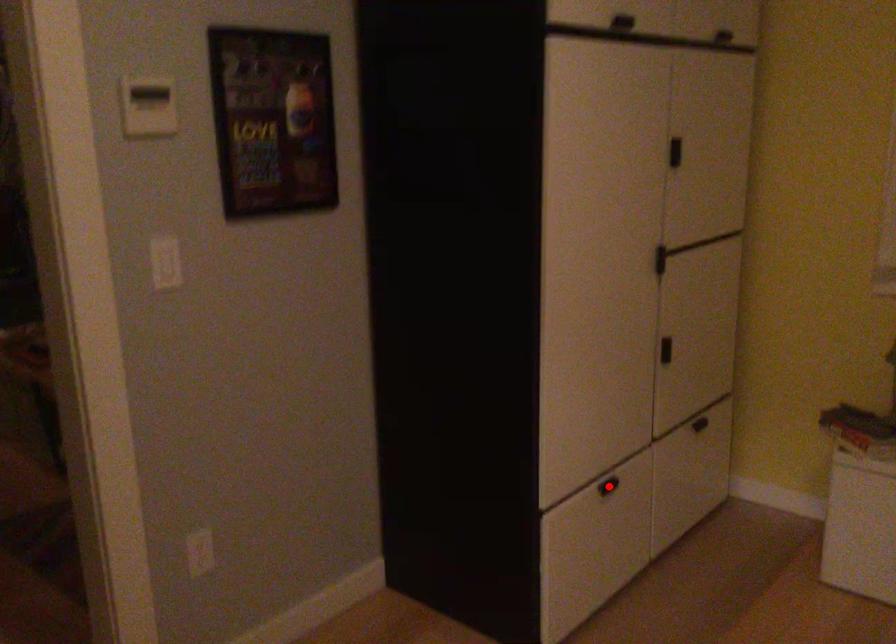
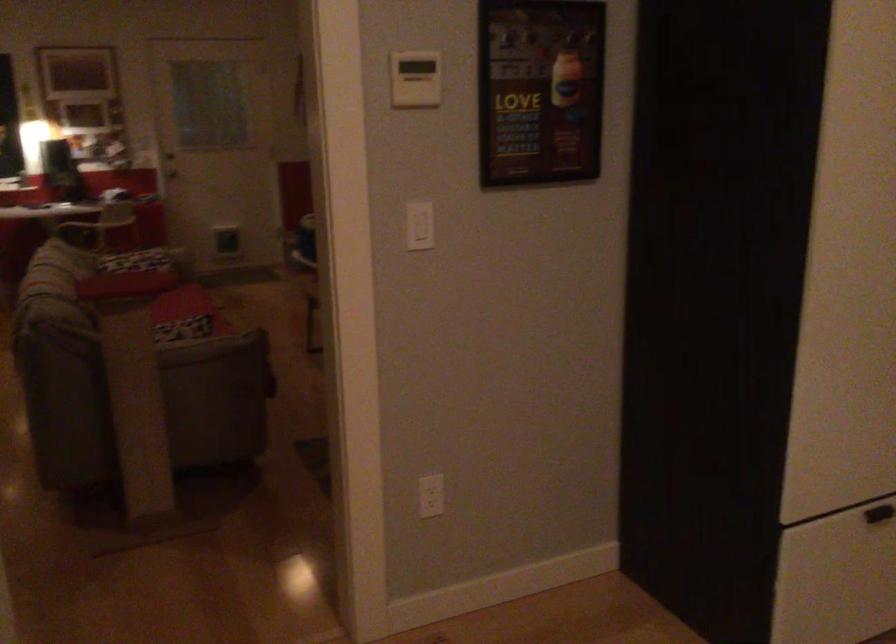
Where in the second image is the point corresponding to the highlighted location from the first image?

(879, 514)